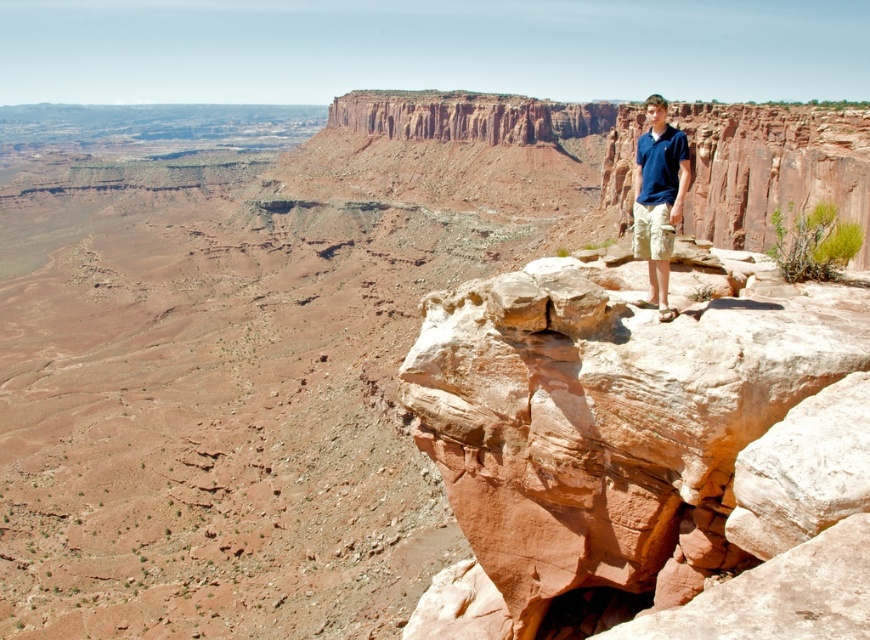
Question: Which point is closer to the camera?

Choices:
 (A) (847, 512)
 (B) (651, 211)

Answer: (A)

Question: Can you confirm if rustic sandstone rock at upper right is bigger than blue cotton polo shirt at upper right?

Choices:
 (A) no
 (B) yes

Answer: (A)

Question: Which object appears closest to the camera in this image?

Choices:
 (A) blue cotton polo shirt at upper right
 (B) rustic sandstone rock at upper right

Answer: (B)

Question: Among these points, which one is farthest from the camera?

Choices:
 (A) (654, 99)
 (B) (664, 387)

Answer: (A)

Question: Is rustic sandstone rock at upper right closer to camera compared to blue cotton polo shirt at upper right?

Choices:
 (A) no
 (B) yes

Answer: (B)

Question: From the image, what is the correct spatial relationship of rustic sandstone rock at upper right in relation to blue cotton polo shirt at upper right?

Choices:
 (A) above
 (B) below

Answer: (B)